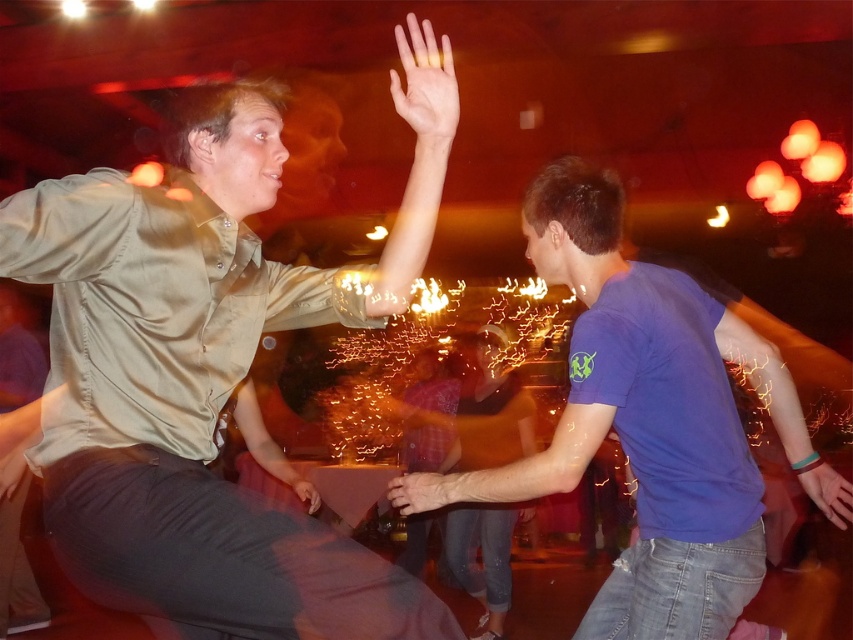
Question: Which of the following is the closest to the observer?

Choices:
 (A) matte khaki shirt at upper left
 (B) blue cotton shirt at center

Answer: (A)

Question: Which point appears farthest from the camera in this image?

Choices:
 (A) (468, 500)
 (B) (422, 627)
 (C) (498, 568)

Answer: (C)

Question: Estimate the real-world distances between objects in this image. Which object is farther from the matte khaki shirt at upper left?

Choices:
 (A) blue cotton shirt at center
 (B) blue cotton t-shirt at right

Answer: (A)

Question: Is matte khaki shirt at upper left further to the viewer compared to blue cotton t-shirt at right?

Choices:
 (A) no
 (B) yes

Answer: (A)

Question: Is matte khaki shirt at upper left thinner than blue cotton shirt at center?

Choices:
 (A) yes
 (B) no

Answer: (B)

Question: Can you confirm if matte khaki shirt at upper left is positioned above blue cotton shirt at center?

Choices:
 (A) yes
 (B) no

Answer: (A)